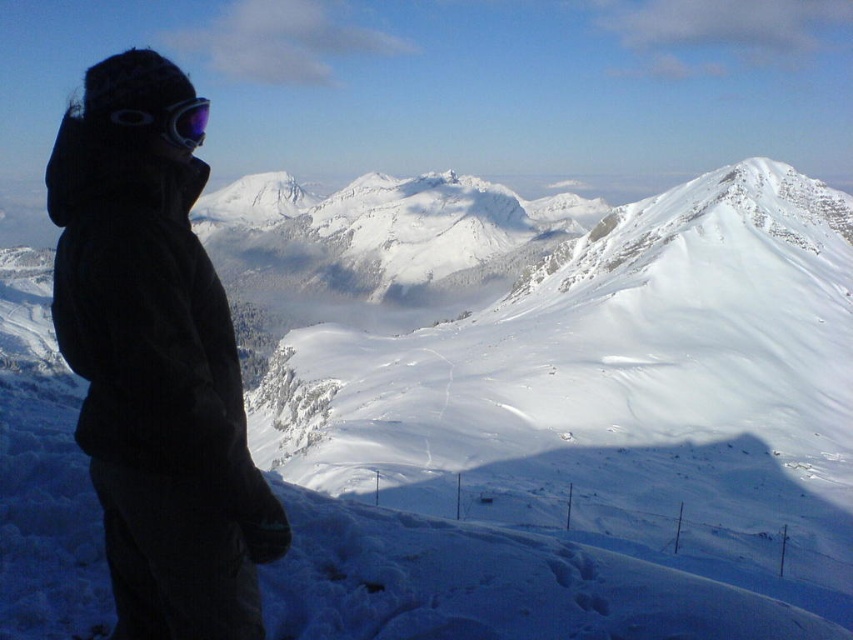
You are a photographer trying to capture the perfect shot of the black fleece jacket at left and the matte purple goggles at upper left. If you want to ensure both objects are in frame without cropping, which object requires more space horizontally?

The black fleece jacket at left requires more horizontal space because its width surpasses that of the matte purple goggles at upper left.

You are a photographer trying to capture a photo of the black fleece jacket at left and the matte purple goggles at upper left in the same frame. Given that your camera has a maximum focus range of 20 feet, will you be able to get both objects in focus?

The black fleece jacket at left and the matte purple goggles at upper left are 21.32 feet apart from each other. Since the distance between them exceeds the camera maximum focus range of 20 feet, you won not be able to get both objects in focus at the same time.